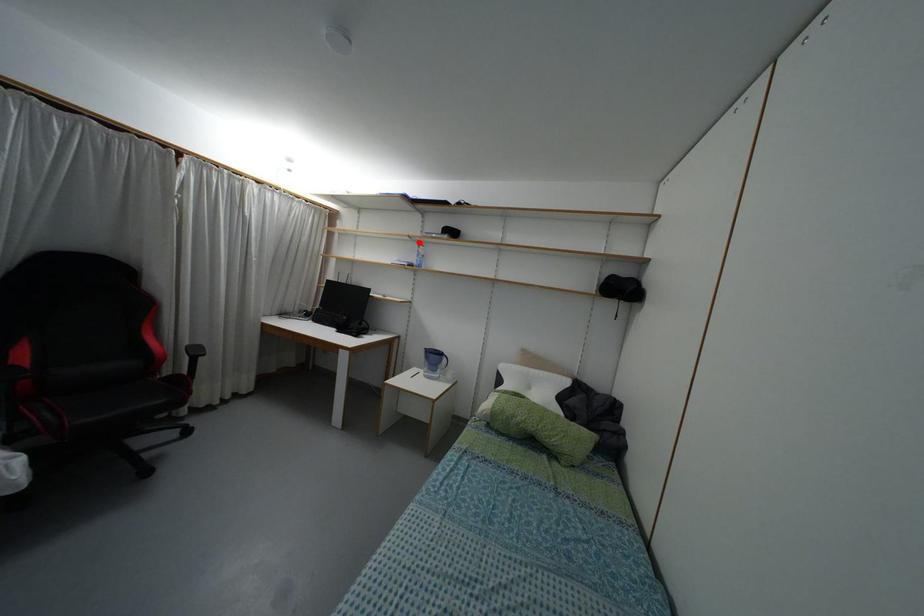
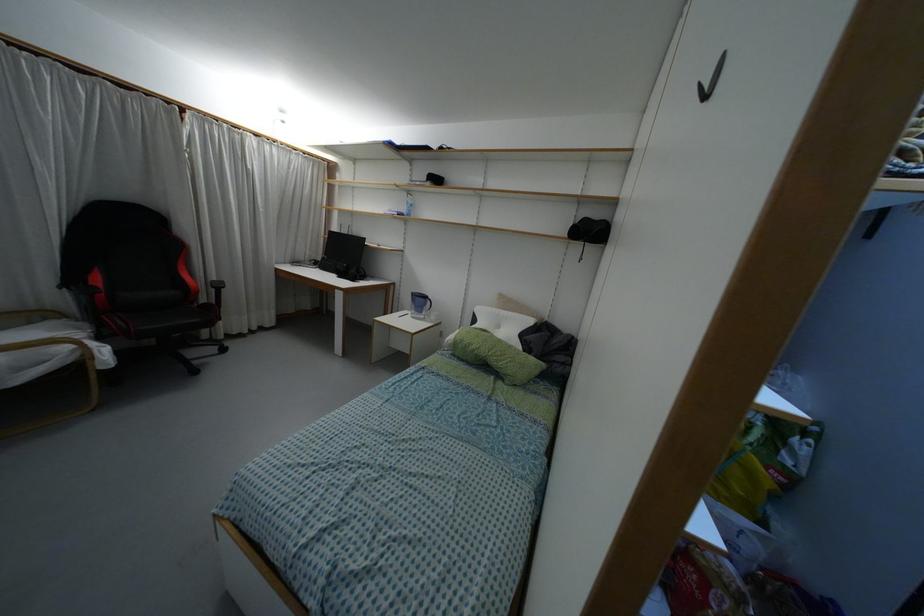
Find the pixel in the second image that matches the highlighted location in the first image.

(407, 192)